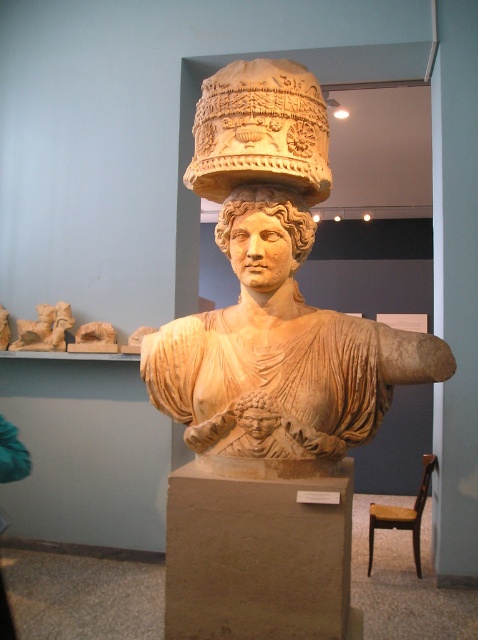
Question: Which point appears closest to the camera in this image?

Choices:
 (A) (282, 189)
 (B) (239, 205)
 (C) (260, 394)

Answer: (C)

Question: Considering the real-world distances, which object is closest to the matte stone head at center?

Choices:
 (A) beige stone pedestal at center
 (B) matte beige head at center
 (C) beige stone bust at center

Answer: (A)

Question: Which object is positioned closest to the matte stone head at center?

Choices:
 (A) beige stone bust at center
 (B) beige stone pedestal at center
 (C) matte beige head at center

Answer: (B)

Question: Is beige stone bust at center positioned behind matte stone head at center?

Choices:
 (A) no
 (B) yes

Answer: (A)

Question: Can you confirm if beige stone bust at center is wider than matte beige head at center?

Choices:
 (A) yes
 (B) no

Answer: (A)

Question: Does beige stone bust at center lie behind beige stone pedestal at center?

Choices:
 (A) no
 (B) yes

Answer: (B)